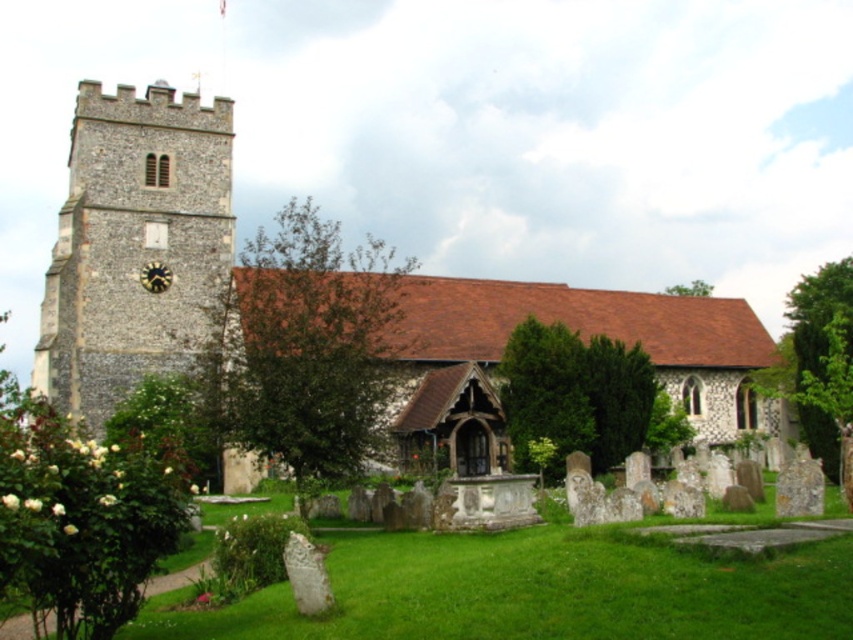
You are standing at the entrance of the churchyard and want to take a photo of the green leafy tree at right. Which direction should you face to ensure the tree is in the center of your photo?

The green leafy tree at right is located at point coordinates, so you should face towards the right side of the churchyard to center it in your photo.

You are a visitor standing at the entrance of the churchyard. You notice the stone church at center and the green leafy tree at center. Which object is closer to you?

The stone church at center is closer to you because the green leafy tree at center is behind it.

From the picture: You are a landscape architect designing a walking path between the two green leafy trees. The path must be exactly 25 meters long. Can the path be directly straight between the green leafy tree at right and the green leafy tree at upper right?

The distance between the green leafy tree at right and the green leafy tree at upper right is 23.70 meters. Since the required path length is 25 meters, a straight path would be too short. Therefore, the path cannot be directly straight between them to meet the 25 meters requirement.